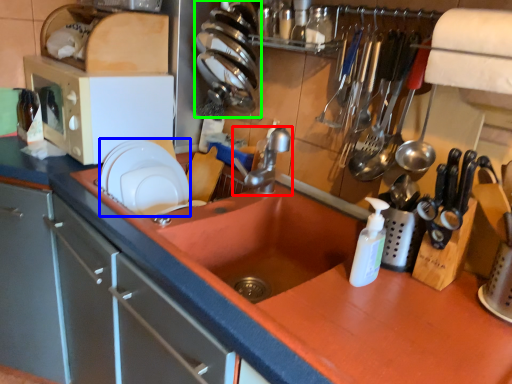
Question: Based on their relative distances, which object is nearer to tap (highlighted by a red box)? Choose from tableware (highlighted by a blue box) and tableware (highlighted by a green box).

Choices:
 (A) tableware
 (B) tableware

Answer: (B)